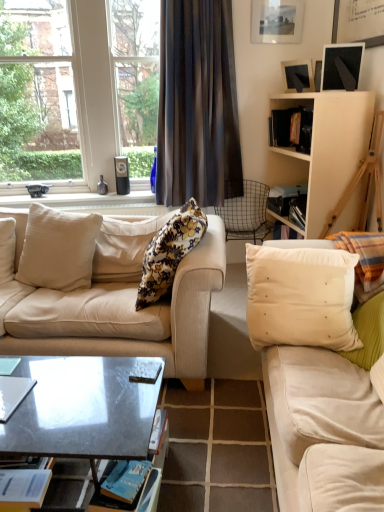
Identify the location of vacant space to the right of matte gray magazine at lower left, which is the 2th magazine in bottom-to-top order. (50, 399).